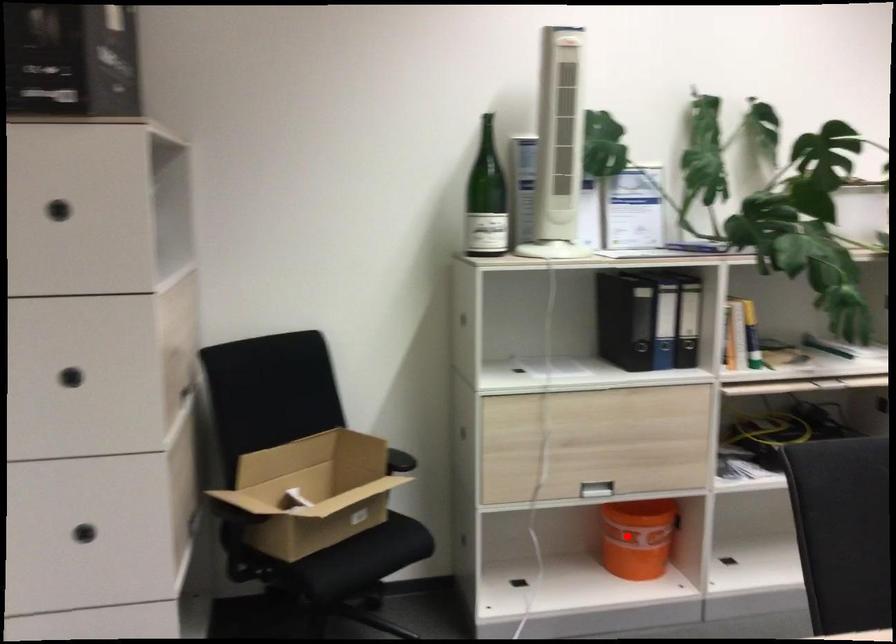
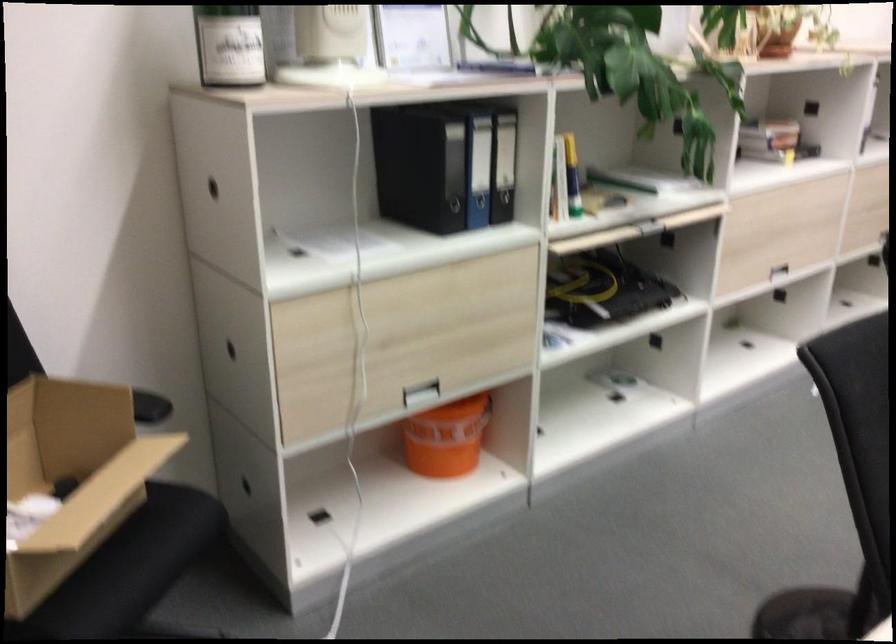
In the second image, find the point that corresponds to the highlighted location in the first image.

(446, 438)